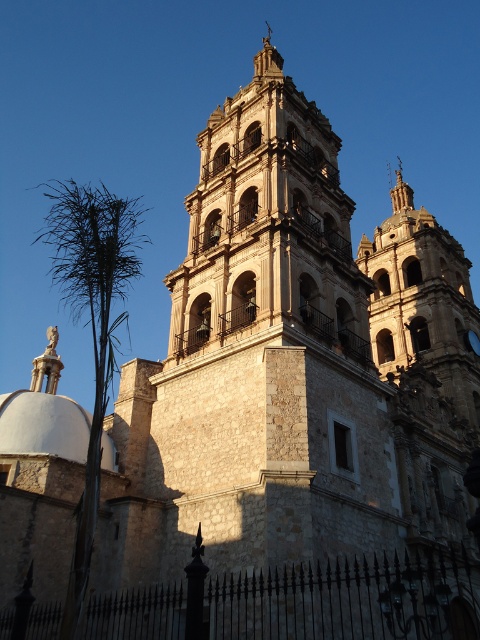
Question: Which point is closer to the camera?

Choices:
 (A) green leafy palm tree at left
 (B) stone bell tower at upper right
 (C) white stone dome at lower left

Answer: (A)

Question: Can you confirm if stone bell tower at upper right is positioned to the right of green leafy palm tree at left?

Choices:
 (A) no
 (B) yes

Answer: (B)

Question: From the image, what is the correct spatial relationship of green leafy palm tree at left in relation to white stone dome at lower left?

Choices:
 (A) above
 (B) below

Answer: (A)

Question: Which of the following is the farthest from the observer?

Choices:
 (A) (60, 273)
 (B) (62, 422)

Answer: (A)

Question: Is stone bell tower at upper right wider than green leafy palm tree at left?

Choices:
 (A) yes
 (B) no

Answer: (B)

Question: Which point is farther from the camera taking this photo?

Choices:
 (A) (76, 413)
 (B) (128, 268)
 (C) (439, 324)

Answer: (C)